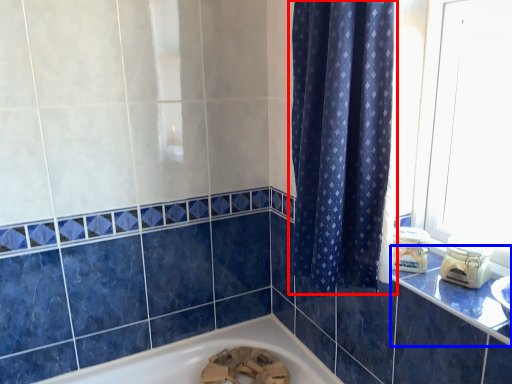
Question: Which object appears farthest to the camera in this image, curtain (highlighted by a red box) or counter top (highlighted by a blue box)?

Choices:
 (A) curtain
 (B) counter top

Answer: (A)